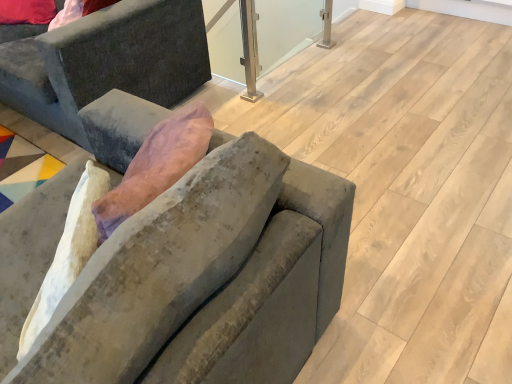
Image resolution: width=512 pixels, height=384 pixels. What do you see at coordinates (208, 277) in the screenshot?
I see `velvet gray couch at center, positioned as the 2th studio couch in top-to-bottom order` at bounding box center [208, 277].

Locate an element on the screen. This screenshot has height=384, width=512. velvet gray couch at left, which appears as the first studio couch when viewed from the back is located at coordinates (106, 61).

Does velvet gray couch at center, acting as the 1th studio couch starting from the bottom, lie behind velvet gray couch at left, the 1th studio couch when ordered from top to bottom?

No.

Is point (302, 245) closer or farther from the camera than point (163, 72)?

Clearly, point (302, 245) is closer to the camera than point (163, 72).

Considering the sizes of velvet gray couch at center, positioned as the 2th studio couch in top-to-bottom order, and velvet gray couch at left, the 1th studio couch when ordered from top to bottom, in the image, is velvet gray couch at center, positioned as the 2th studio couch in top-to-bottom order, bigger or smaller than velvet gray couch at left, the 1th studio couch when ordered from top to bottom,?

velvet gray couch at center, positioned as the 2th studio couch in top-to-bottom order, is smaller than velvet gray couch at left, the 1th studio couch when ordered from top to bottom.

From a real-world perspective, is velvet gray couch at center, positioned as the 2th studio couch in back-to-front order, positioned above or below velvet gray couch at left, which ranks as the 2th studio couch in bottom-to-top order?

velvet gray couch at center, positioned as the 2th studio couch in back-to-front order, is above velvet gray couch at left, which ranks as the 2th studio couch in bottom-to-top order.

Is clear glass window screen at center with velvet gray couch at center, which appears as the first studio couch when viewed from the front?

No, clear glass window screen at center is not next to velvet gray couch at center, which appears as the first studio couch when viewed from the front.

Is clear glass window screen at center oriented away from velvet gray couch at center, positioned as the 2th studio couch in back-to-front order?

clear glass window screen at center does not have its back to velvet gray couch at center, positioned as the 2th studio couch in back-to-front order.

From the image's perspective, which is above, clear glass window screen at center or velvet gray couch at center, which appears as the first studio couch when viewed from the front?

From the image's view, clear glass window screen at center is above.

From a real-world perspective, is clear glass window screen at center on top of velvet gray couch at center, which appears as the first studio couch when viewed from the front?

No, from a real-world perspective, clear glass window screen at center is not on top of velvet gray couch at center, which appears as the first studio couch when viewed from the front.

Can you confirm if velvet gray couch at left, which appears as the first studio couch when viewed from the back, is positioned to the left of velvet gray couch at center, positioned as the 2th studio couch in back-to-front order?

Indeed, velvet gray couch at left, which appears as the first studio couch when viewed from the back, is positioned on the left side of velvet gray couch at center, positioned as the 2th studio couch in back-to-front order.

Is velvet gray couch at left, acting as the second studio couch starting from the front, located outside velvet gray couch at center, positioned as the 2th studio couch in top-to-bottom order?

velvet gray couch at left, acting as the second studio couch starting from the front, is positioned outside velvet gray couch at center, positioned as the 2th studio couch in top-to-bottom order.

From a real-world perspective, is velvet gray couch at left, acting as the second studio couch starting from the front, located higher than velvet gray couch at center, positioned as the 2th studio couch in back-to-front order?

No.

Considering the relative sizes of velvet gray couch at left, the 1th studio couch when ordered from top to bottom, and clear glass window screen at center in the image provided, is velvet gray couch at left, the 1th studio couch when ordered from top to bottom, shorter than clear glass window screen at center?

In fact, velvet gray couch at left, the 1th studio couch when ordered from top to bottom, may be taller than clear glass window screen at center.

Considering the relative positions of velvet gray couch at left, acting as the second studio couch starting from the front, and clear glass window screen at center in the image provided, is velvet gray couch at left, acting as the second studio couch starting from the front, to the left of clear glass window screen at center from the viewer's perspective?

Indeed, velvet gray couch at left, acting as the second studio couch starting from the front, is positioned on the left side of clear glass window screen at center.

Could clear glass window screen at center be considered to be inside velvet gray couch at left, acting as the second studio couch starting from the front?

That's incorrect, clear glass window screen at center is not inside velvet gray couch at left, acting as the second studio couch starting from the front.

Which of these two, clear glass window screen at center or velvet gray couch at left, which ranks as the 2th studio couch in bottom-to-top order, is wider?

Wider between the two is velvet gray couch at left, which ranks as the 2th studio couch in bottom-to-top order.

The width and height of the screenshot is (512, 384). In the image, there is a velvet gray couch at left, which appears as the first studio couch when viewed from the back. In order to click on window screen below it (from the image's perspective) in this screenshot , I will do `click(286, 29)`.

Is clear glass window screen at center to the left or to the right of velvet gray couch at left, which ranks as the 2th studio couch in bottom-to-top order, in the image?

clear glass window screen at center is to the right of velvet gray couch at left, which ranks as the 2th studio couch in bottom-to-top order.

How much distance is there between clear glass window screen at center and velvet gray couch at left, the 1th studio couch when ordered from top to bottom?

The distance of clear glass window screen at center from velvet gray couch at left, the 1th studio couch when ordered from top to bottom, is 6.68 feet.

Does velvet gray couch at center, acting as the 1th studio couch starting from the bottom, have a greater width compared to clear glass window screen at center?

Indeed, velvet gray couch at center, acting as the 1th studio couch starting from the bottom, has a greater width compared to clear glass window screen at center.

Is velvet gray couch at center, which appears as the first studio couch when viewed from the front, surrounding clear glass window screen at center?

That's incorrect, clear glass window screen at center is not inside velvet gray couch at center, which appears as the first studio couch when viewed from the front.

Is velvet gray couch at center, which appears as the first studio couch when viewed from the front, next to clear glass window screen at center?

No, velvet gray couch at center, which appears as the first studio couch when viewed from the front, is not making contact with clear glass window screen at center.

Is velvet gray couch at center, positioned as the 2th studio couch in back-to-front order, positioned before clear glass window screen at center?

Yes, it is in front of clear glass window screen at center.

The height and width of the screenshot is (384, 512). Identify the location of studio couch lying on the left of velvet gray couch at center, which appears as the first studio couch when viewed from the front. (106, 61).

This screenshot has width=512, height=384. Find the location of `studio couch below the clear glass window screen at center (from the image's perspective)`. studio couch below the clear glass window screen at center (from the image's perspective) is located at coordinates (208, 277).

When comparing their distances from clear glass window screen at center, does velvet gray couch at left, acting as the second studio couch starting from the front, or velvet gray couch at center, positioned as the 2th studio couch in back-to-front order, seem further?

velvet gray couch at center, positioned as the 2th studio couch in back-to-front order, lies further to clear glass window screen at center than the other object.

From the image, which object appears to be nearer to velvet gray couch at left, acting as the second studio couch starting from the front, clear glass window screen at center or velvet gray couch at center, positioned as the 2th studio couch in top-to-bottom order?

velvet gray couch at center, positioned as the 2th studio couch in top-to-bottom order, lies closer to velvet gray couch at left, acting as the second studio couch starting from the front, than the other object.

Based on their spatial positions, is velvet gray couch at center, which appears as the first studio couch when viewed from the front, or velvet gray couch at left, acting as the second studio couch starting from the front, closer to clear glass window screen at center?

velvet gray couch at left, acting as the second studio couch starting from the front, is closer to clear glass window screen at center.

In the scene shown: Based on their spatial positions, is clear glass window screen at center or velvet gray couch at left, which appears as the first studio couch when viewed from the back, closer to velvet gray couch at center, acting as the 1th studio couch starting from the bottom?

Based on the image, velvet gray couch at left, which appears as the first studio couch when viewed from the back, appears to be nearer to velvet gray couch at center, acting as the 1th studio couch starting from the bottom.

Which object lies further to the anchor point velvet gray couch at left, the 1th studio couch when ordered from top to bottom, velvet gray couch at center, acting as the 1th studio couch starting from the bottom, or clear glass window screen at center?

clear glass window screen at center is positioned further to the anchor velvet gray couch at left, the 1th studio couch when ordered from top to bottom.

Estimate the real-world distances between objects in this image. Which object is further from velvet gray couch at center, positioned as the 2th studio couch in back-to-front order, velvet gray couch at left, which ranks as the 2th studio couch in bottom-to-top order, or clear glass window screen at center?

clear glass window screen at center is further to velvet gray couch at center, positioned as the 2th studio couch in back-to-front order.

In order to click on studio couch between velvet gray couch at center, positioned as the 2th studio couch in top-to-bottom order, and clear glass window screen at center, along the z-axis in this screenshot , I will do `click(106, 61)`.